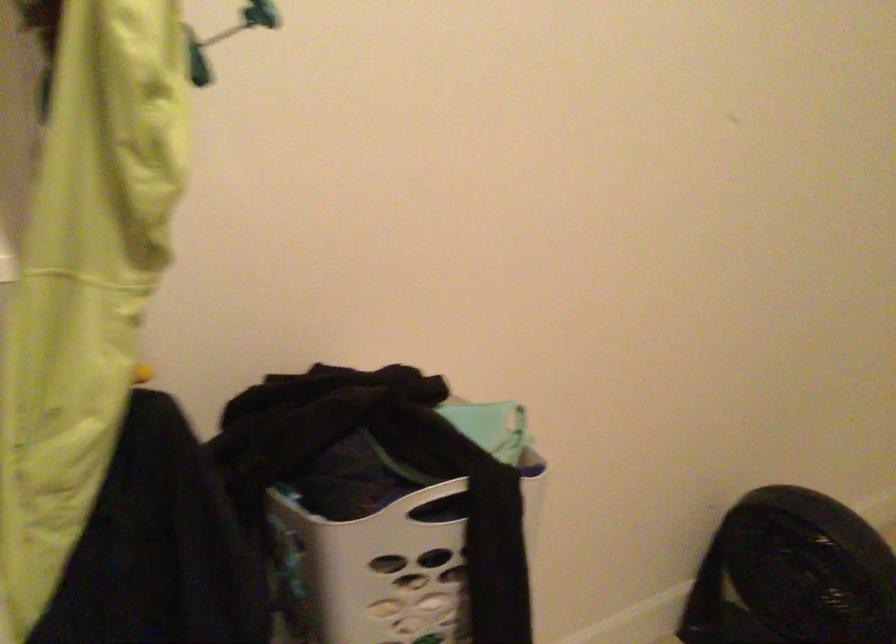
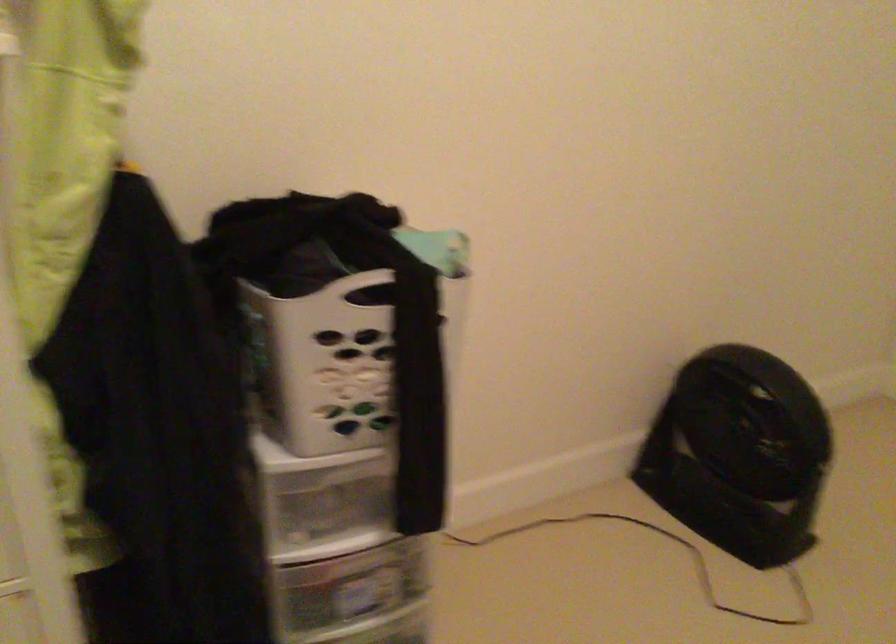
Consider the image. In a continuous first-person perspective shot, in which direction is the camera moving?

The cameraman walked toward right, backward.